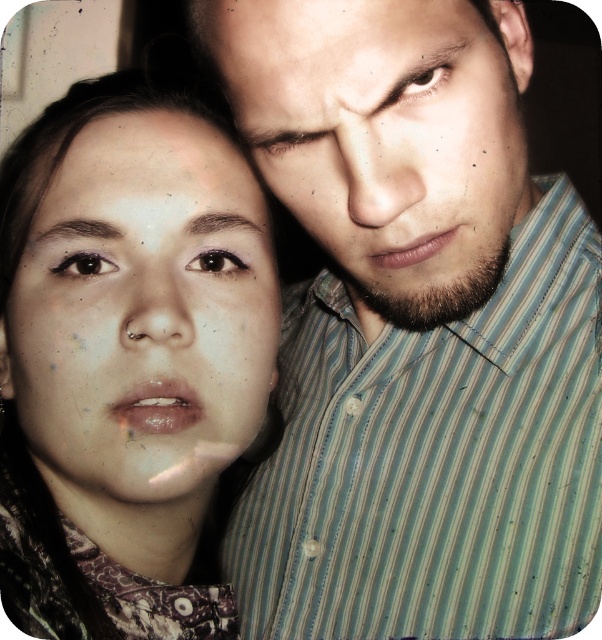
Looking at this image, is striped shirt at upper right taller than matte striped shirt at upper right?

Correct, striped shirt at upper right is much taller as matte striped shirt at upper right.

Between striped shirt at upper right and matte striped shirt at upper right, which one is positioned higher?

matte striped shirt at upper right is higher up.

At what (x,y) coordinates should I click in order to perform the action: click on striped shirt at upper right. Please return your answer as a coordinate pair (x, y). This screenshot has height=640, width=602. Looking at the image, I should click on (417, 330).

Between matte skin face at left and matte striped shirt at upper right, which one is positioned lower?

matte skin face at left is below.

Does point (172, 189) come in front of point (458, 61)?

No, (172, 189) is behind (458, 61).

At what (x,y) coordinates should I click in order to perform the action: click on matte skin face at left. Please return your answer as a coordinate pair (x, y). Looking at the image, I should click on (143, 314).

Which is below, striped shirt at upper right or matte skin face at left?

Positioned lower is striped shirt at upper right.

Does point (343, 593) lie behind point (223, 340)?

Yes, point (343, 593) is farther from viewer.

Image resolution: width=602 pixels, height=640 pixels. I want to click on striped shirt at upper right, so click(x=417, y=330).

Find the location of a particular element. striped shirt at upper right is located at coordinates [x=417, y=330].